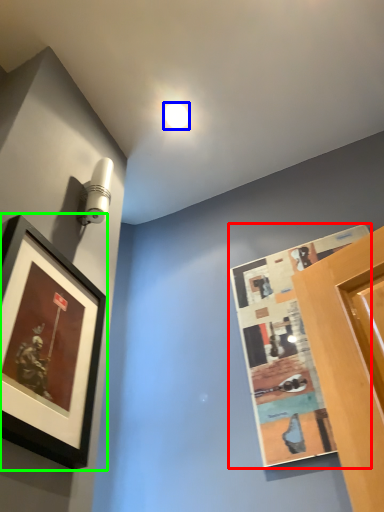
Question: Considering the real-world distances, which object is closest to picture frame (highlighted by a red box)? droplight (highlighted by a blue box) or picture frame (highlighted by a green box).

Choices:
 (A) droplight
 (B) picture frame

Answer: (B)